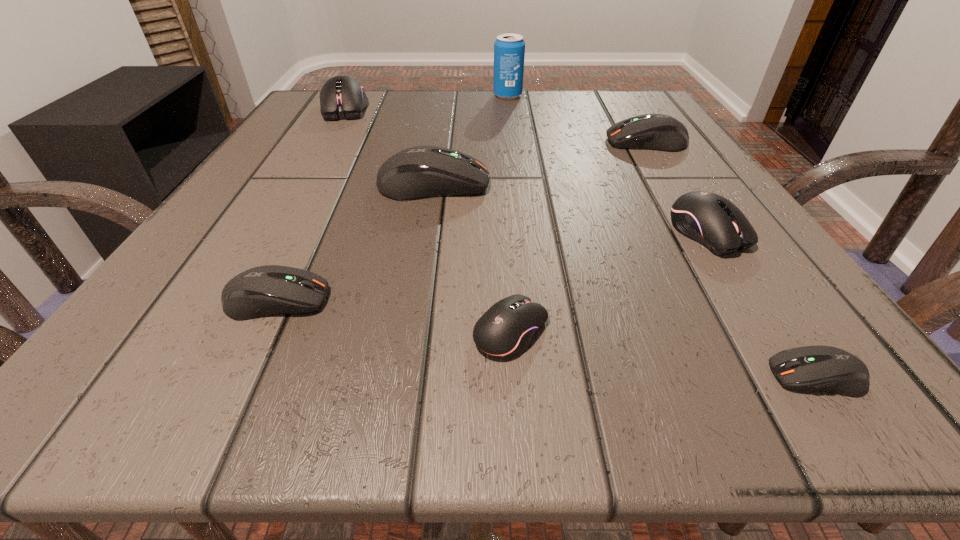
Locate an element on the screen. Image resolution: width=960 pixels, height=540 pixels. the leftmost dark computer equipment is located at coordinates (262, 291).

Image resolution: width=960 pixels, height=540 pixels. In order to click on the second nearest dark computer equipment in this screenshot , I will do `click(262, 291)`.

Where is `the second black computer mouse from left to right`? the second black computer mouse from left to right is located at coordinates 506,329.

Find the location of `the smallest black computer mouse`. the smallest black computer mouse is located at coordinates (506, 329).

Where is `the smallest dark computer equipment`? This screenshot has width=960, height=540. the smallest dark computer equipment is located at coordinates (820, 368).

The width and height of the screenshot is (960, 540). Identify the location of the shortest computer equipment. (820, 368).

Identify the location of free space located on the front of the tallest object. Image resolution: width=960 pixels, height=540 pixels. tap(512, 130).

The width and height of the screenshot is (960, 540). I want to click on vacant space located on the right of the farthest black computer mouse, so click(438, 109).

This screenshot has height=540, width=960. In order to click on vacant space situated 0.320m on the button of the fifth nearest object in this screenshot , I will do `click(688, 185)`.

At what (x,y) coordinates should I click in order to perform the action: click on free region located 0.160m on the button of the second biggest dark computer equipment. Please return your answer as a coordinate pair (x, y). Looking at the image, I should click on (520, 142).